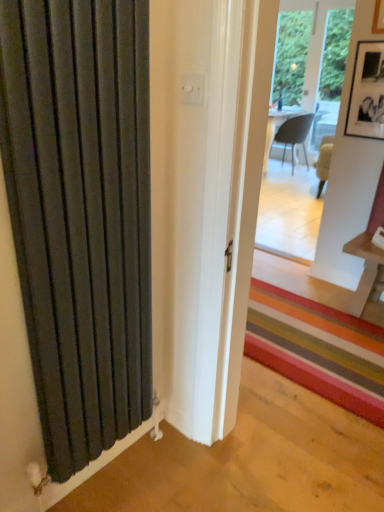
Question: Could you tell me if black matte picture frame at upper right is turned towards matte black radiator at left?

Choices:
 (A) no
 (B) yes

Answer: (B)

Question: From the image's perspective, is black matte picture frame at upper right beneath matte black radiator at left?

Choices:
 (A) yes
 (B) no

Answer: (B)

Question: Is black matte picture frame at upper right positioned before matte black radiator at left?

Choices:
 (A) yes
 (B) no

Answer: (B)

Question: Is black matte picture frame at upper right thinner than matte black radiator at left?

Choices:
 (A) no
 (B) yes

Answer: (B)

Question: Does black matte picture frame at upper right contain matte black radiator at left?

Choices:
 (A) no
 (B) yes

Answer: (A)

Question: Do you think matte gray chair at center is within matte black radiator at left, or outside of it?

Choices:
 (A) outside
 (B) inside

Answer: (A)

Question: Considering their positions, is matte gray chair at center located in front of or behind matte black radiator at left?

Choices:
 (A) front
 (B) behind

Answer: (B)

Question: Is point (281, 126) positioned closer to the camera than point (62, 10)?

Choices:
 (A) closer
 (B) farther

Answer: (B)

Question: Is matte gray chair at center to the left or to the right of matte black radiator at left in the image?

Choices:
 (A) right
 (B) left

Answer: (A)

Question: Considering the positions of point (8, 1) and point (294, 126), is point (8, 1) closer or farther from the camera than point (294, 126)?

Choices:
 (A) closer
 (B) farther

Answer: (A)

Question: Considering the relative positions of matte black radiator at left and matte gray chair at center in the image provided, is matte black radiator at left to the left or to the right of matte gray chair at center?

Choices:
 (A) right
 (B) left

Answer: (B)

Question: Relative to matte gray chair at center, is matte black radiator at left in front or behind?

Choices:
 (A) behind
 (B) front

Answer: (B)

Question: From a real-world perspective, is matte black radiator at left physically located above or below matte gray chair at center?

Choices:
 (A) below
 (B) above

Answer: (B)

Question: From the image's perspective, is matte black radiator at left above or below black matte picture frame at upper right?

Choices:
 (A) below
 (B) above

Answer: (A)

Question: Looking at their shapes, would you say matte black radiator at left is wider or thinner than black matte picture frame at upper right?

Choices:
 (A) thin
 (B) wide

Answer: (B)